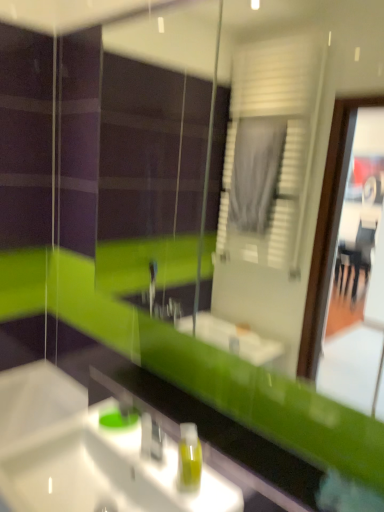
Question: Is white glossy sink at lower left with green translucent soap dispenser at lower center?

Choices:
 (A) no
 (B) yes

Answer: (A)

Question: From the image's perspective, is white glossy sink at lower left under green translucent soap dispenser at lower center?

Choices:
 (A) yes
 (B) no

Answer: (A)

Question: Is white glossy sink at lower left thinner than green translucent soap dispenser at lower center?

Choices:
 (A) yes
 (B) no

Answer: (B)

Question: Is white glossy sink at lower left bigger than green translucent soap dispenser at lower center?

Choices:
 (A) no
 (B) yes

Answer: (B)

Question: Can you confirm if white glossy sink at lower left is wider than green translucent soap dispenser at lower center?

Choices:
 (A) no
 (B) yes

Answer: (B)

Question: Is white glossy sink at lower left oriented towards green translucent soap dispenser at lower center?

Choices:
 (A) no
 (B) yes

Answer: (A)

Question: Is the depth of teal glass soap dispenser at center greater than that of white glossy sink at lower left?

Choices:
 (A) no
 (B) yes

Answer: (B)

Question: Considering the relative sizes of teal glass soap dispenser at center and white glossy sink at lower left in the image provided, is teal glass soap dispenser at center thinner than white glossy sink at lower left?

Choices:
 (A) no
 (B) yes

Answer: (B)

Question: From a real-world perspective, is teal glass soap dispenser at center on white glossy sink at lower left?

Choices:
 (A) yes
 (B) no

Answer: (A)

Question: Is teal glass soap dispenser at center not inside white glossy sink at lower left?

Choices:
 (A) yes
 (B) no

Answer: (A)

Question: Is white glossy sink at lower left a part of teal glass soap dispenser at center?

Choices:
 (A) no
 (B) yes

Answer: (A)

Question: From the image's perspective, is teal glass soap dispenser at center above white glossy sink at lower left?

Choices:
 (A) no
 (B) yes

Answer: (B)

Question: From a real-world perspective, is teal glass soap dispenser at center located beneath green translucent soap dispenser at lower center?

Choices:
 (A) yes
 (B) no

Answer: (A)